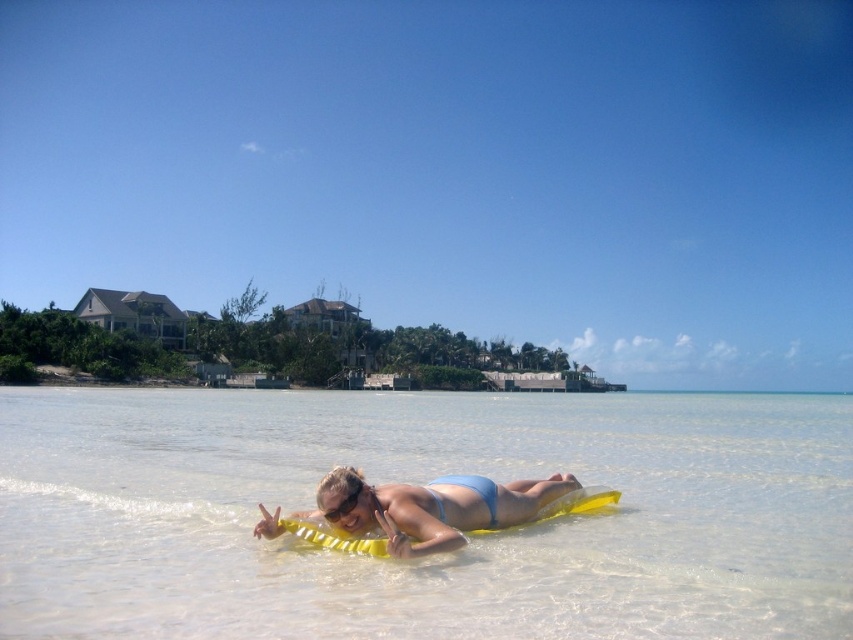
Question: Which point is farther to the camera?

Choices:
 (A) (520, 628)
 (B) (355, 500)

Answer: (B)

Question: Which is farther from the transparent plastic goggles at center?

Choices:
 (A) clear water at center
 (B) blue matte bikini top at center
 (C) blue matte bikini at center

Answer: (A)

Question: Does clear water at center have a greater width compared to blue matte bikini top at center?

Choices:
 (A) no
 (B) yes

Answer: (B)

Question: Observing the image, what is the correct spatial positioning of clear water at center in reference to blue matte bikini at center?

Choices:
 (A) left
 (B) right

Answer: (A)

Question: Considering the relative positions of blue matte bikini top at center and transparent plastic goggles at center in the image provided, where is blue matte bikini top at center located with respect to transparent plastic goggles at center?

Choices:
 (A) below
 (B) above

Answer: (A)

Question: Which point is farther from the camera taking this photo?

Choices:
 (A) (358, 508)
 (B) (329, 516)
 (C) (595, 449)

Answer: (C)